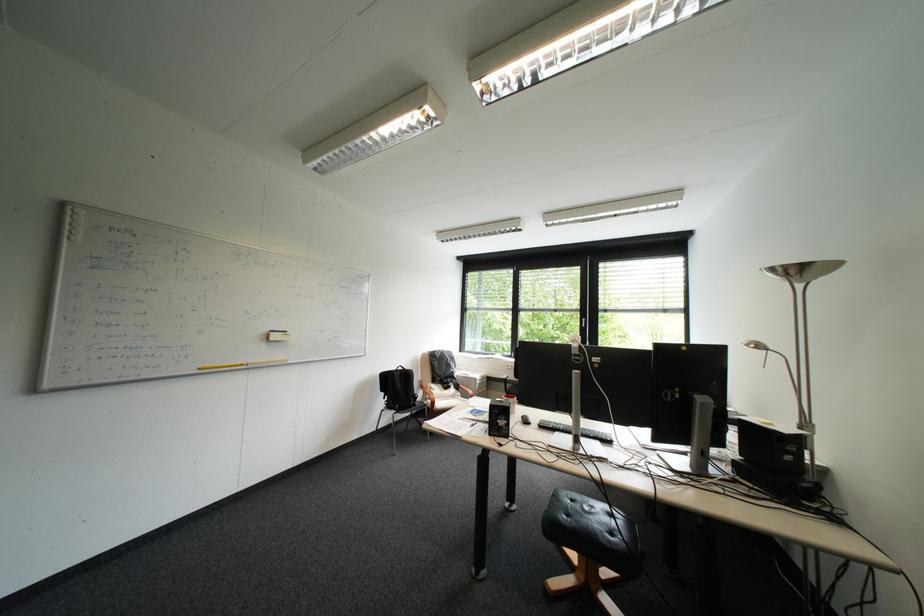
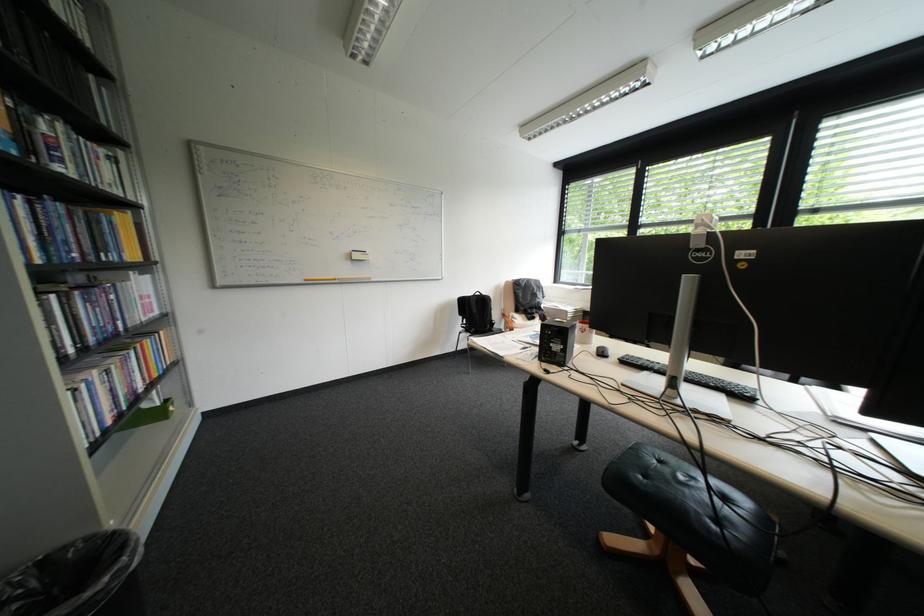
What movement of the cameraman would produce the second image?

The cameraman moved toward right, forward.